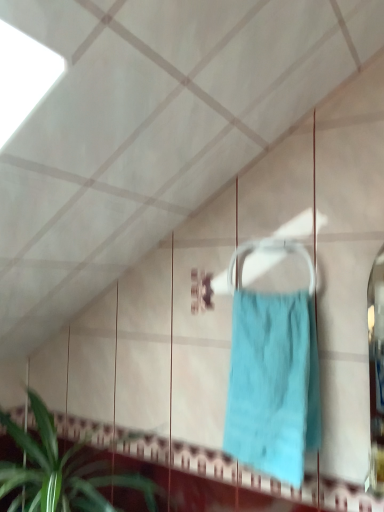
Question: Do you think green leafy plant at lower left is within teal fabric towel at center, or outside of it?

Choices:
 (A) inside
 (B) outside

Answer: (B)

Question: Is green leafy plant at lower left bigger or smaller than teal fabric towel at center?

Choices:
 (A) big
 (B) small

Answer: (A)

Question: From the image's perspective, is green leafy plant at lower left above or below teal fabric towel at center?

Choices:
 (A) above
 (B) below

Answer: (B)

Question: In terms of height, does teal fabric towel at center look taller or shorter compared to green leafy plant at lower left?

Choices:
 (A) short
 (B) tall

Answer: (B)

Question: Is teal fabric towel at center bigger or smaller than green leafy plant at lower left?

Choices:
 (A) big
 (B) small

Answer: (B)

Question: In terms of width, does teal fabric towel at center look wider or thinner when compared to green leafy plant at lower left?

Choices:
 (A) thin
 (B) wide

Answer: (A)

Question: Is teal fabric towel at center spatially inside green leafy plant at lower left, or outside of it?

Choices:
 (A) inside
 (B) outside

Answer: (B)